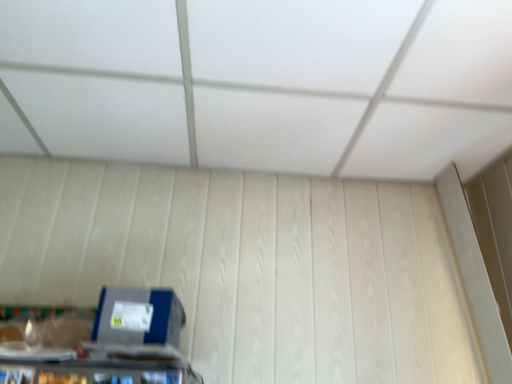
You are a GUI agent. You are given a task and a screenshot of the screen. Output one action in this format:
    pyautogui.click(x=<x>, y=<y>)
    Task: Click on the blue cardboard box at lower left
    
    Given the screenshot: What is the action you would take?
    [x=138, y=316]

The height and width of the screenshot is (384, 512). What do you see at coordinates (138, 316) in the screenshot? I see `blue cardboard box at lower left` at bounding box center [138, 316].

Describe the element at coordinates (261, 83) in the screenshot. I see `white matte exhaust hood at upper center` at that location.

The width and height of the screenshot is (512, 384). I want to click on white matte exhaust hood at upper center, so tap(261, 83).

Locate an element on the screen. Image resolution: width=512 pixels, height=384 pixels. blue cardboard box at lower left is located at coordinates (138, 316).

Is white matte exhaust hood at upper center to the left or to the right of blue cardboard box at lower left in the image?

From the image, it's evident that white matte exhaust hood at upper center is to the right of blue cardboard box at lower left.

Which object is closer to the camera, white matte exhaust hood at upper center or blue cardboard box at lower left?

white matte exhaust hood at upper center is closer to the camera.

Which point is more forward, (282, 75) or (105, 339)?

The point (105, 339) is closer.

From the image's perspective, does white matte exhaust hood at upper center appear lower than blue cardboard box at lower left?

Actually, white matte exhaust hood at upper center appears above blue cardboard box at lower left in the image.

From a real-world perspective, is white matte exhaust hood at upper center beneath blue cardboard box at lower left?

No, from a real-world perspective, white matte exhaust hood at upper center is not under blue cardboard box at lower left.

Between white matte exhaust hood at upper center and blue cardboard box at lower left, which one has larger width?

Wider between the two is white matte exhaust hood at upper center.

From their relative heights in the image, would you say white matte exhaust hood at upper center is taller or shorter than blue cardboard box at lower left?

In the image, white matte exhaust hood at upper center appears to be shorter than blue cardboard box at lower left.

Considering the sizes of white matte exhaust hood at upper center and blue cardboard box at lower left in the image, is white matte exhaust hood at upper center bigger or smaller than blue cardboard box at lower left?

white matte exhaust hood at upper center is bigger than blue cardboard box at lower left.

Is blue cardboard box at lower left a part of white matte exhaust hood at upper center?

Definitely not — blue cardboard box at lower left is not inside white matte exhaust hood at upper center.

Is white matte exhaust hood at upper center beside blue cardboard box at lower left?

No, white matte exhaust hood at upper center is not with blue cardboard box at lower left.

Is white matte exhaust hood at upper center facing towards blue cardboard box at lower left?

No, white matte exhaust hood at upper center is not aimed at blue cardboard box at lower left.

How many degrees apart are the facing directions of white matte exhaust hood at upper center and blue cardboard box at lower left?

The angle between the facing direction of white matte exhaust hood at upper center and the facing direction of blue cardboard box at lower left is 89.6 degrees.

Measure the distance from white matte exhaust hood at upper center to blue cardboard box at lower left.

white matte exhaust hood at upper center and blue cardboard box at lower left are 30.21 inches apart.

The image size is (512, 384). Identify the location of box behind the white matte exhaust hood at upper center. (138, 316).

Considering the relative positions of blue cardboard box at lower left and white matte exhaust hood at upper center in the image provided, is blue cardboard box at lower left to the left of white matte exhaust hood at upper center from the viewer's perspective?

Yes.

In the image, is blue cardboard box at lower left positioned in front of or behind white matte exhaust hood at upper center?

blue cardboard box at lower left is behind white matte exhaust hood at upper center.

Is point (168, 334) farther from viewer compared to point (375, 98)?

No, it is not.

From the image's perspective, would you say blue cardboard box at lower left is shown under white matte exhaust hood at upper center?

Indeed, from the image's perspective, blue cardboard box at lower left is shown beneath white matte exhaust hood at upper center.

From a real-world perspective, who is located higher, blue cardboard box at lower left or white matte exhaust hood at upper center?

From a 3D spatial view, white matte exhaust hood at upper center is above.

Considering the relative sizes of blue cardboard box at lower left and white matte exhaust hood at upper center in the image provided, is blue cardboard box at lower left wider than white matte exhaust hood at upper center?

Incorrect, the width of blue cardboard box at lower left does not surpass that of white matte exhaust hood at upper center.

Can you confirm if blue cardboard box at lower left is taller than white matte exhaust hood at upper center?

Yes.

Who is smaller, blue cardboard box at lower left or white matte exhaust hood at upper center?

Smaller between the two is blue cardboard box at lower left.

Is white matte exhaust hood at upper center surrounded by blue cardboard box at lower left?

No, white matte exhaust hood at upper center is not inside blue cardboard box at lower left.

Does blue cardboard box at lower left touch white matte exhaust hood at upper center?

There is a gap between blue cardboard box at lower left and white matte exhaust hood at upper center.

Could you tell me if blue cardboard box at lower left is facing white matte exhaust hood at upper center?

No, blue cardboard box at lower left is not oriented towards white matte exhaust hood at upper center.

Where is `box below the white matte exhaust hood at upper center (from a real-world perspective)`? box below the white matte exhaust hood at upper center (from a real-world perspective) is located at coordinates (138, 316).

The image size is (512, 384). What are the coordinates of `box on the left of the white matte exhaust hood at upper center` in the screenshot? It's located at (138, 316).

Where is `exhaust hood in front of the blue cardboard box at lower left`? This screenshot has width=512, height=384. exhaust hood in front of the blue cardboard box at lower left is located at coordinates (261, 83).